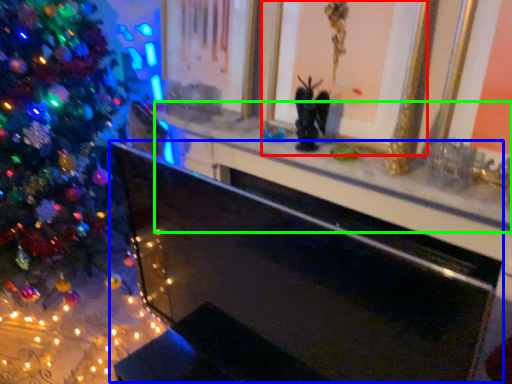
Question: Which is farther away from picture frame (highlighted by a red box)? fireplace (highlighted by a blue box) or mantle (highlighted by a green box)?

Choices:
 (A) fireplace
 (B) mantle

Answer: (A)